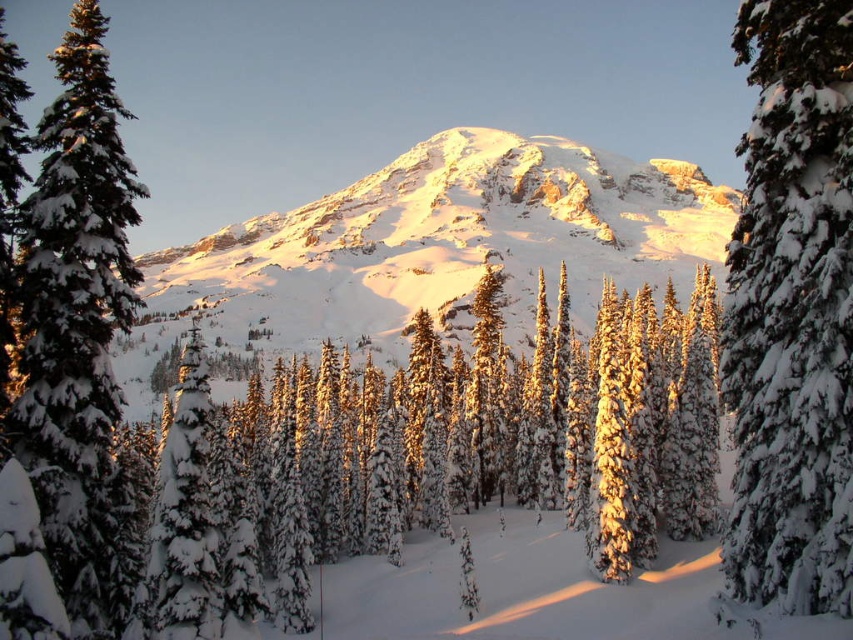
Question: Is white snow-covered mountain at center below snow-covered evergreen at center?

Choices:
 (A) yes
 (B) no

Answer: (B)

Question: From the image, what is the correct spatial relationship of snow-covered pine at center in relation to snow-covered evergreen at center?

Choices:
 (A) right
 (B) left

Answer: (A)

Question: Which point is farther to the camera?

Choices:
 (A) (453, 404)
 (B) (260, 346)
 (C) (125, 582)

Answer: (B)

Question: Based on their relative distances, which object is nearer to the white snow-covered mountain at center?

Choices:
 (A) snow-covered evergreen at center
 (B) snow-covered evergreen at right

Answer: (A)

Question: Is snow-covered pine at center to the right of white snow-covered mountain at center from the viewer's perspective?

Choices:
 (A) no
 (B) yes

Answer: (B)

Question: Which of the following is the closest to the observer?

Choices:
 (A) snow-covered evergreen at center
 (B) white snow-covered mountain at center
 (C) snow-covered evergreen at right
 (D) snow-covered pine at center

Answer: (C)